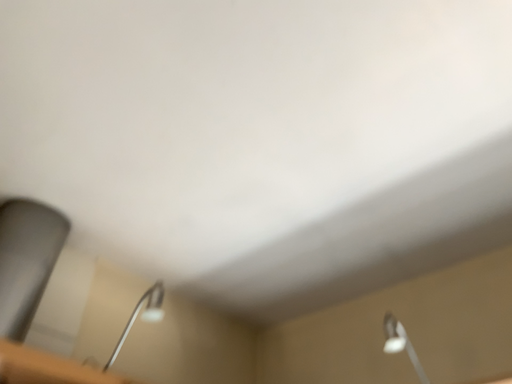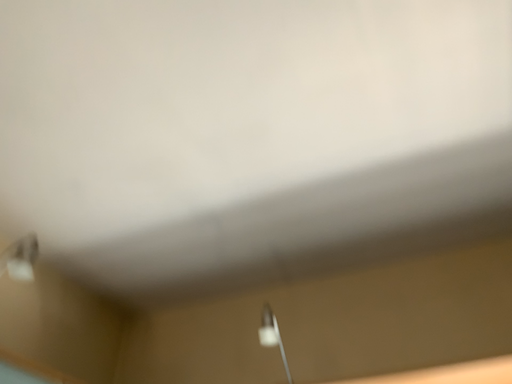
Question: Which way did the camera rotate in the video?

Choices:
 (A) rotated left
 (B) rotated right

Answer: (B)